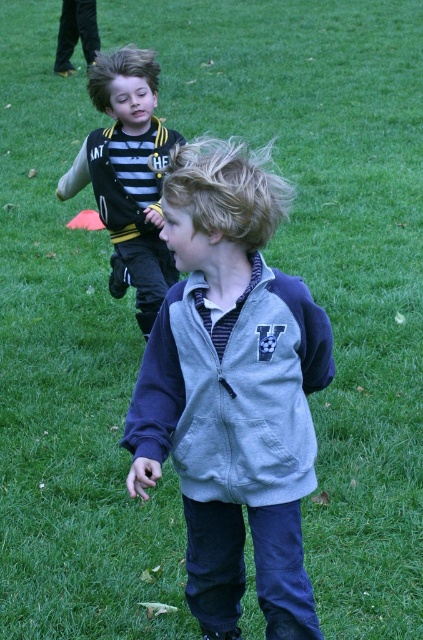
Question: Which point appears closest to the camera in this image?

Choices:
 (A) (154, 125)
 (B) (271, 445)

Answer: (B)

Question: Can you confirm if gray fleece jacket at center is thinner than striped jersey at left?

Choices:
 (A) no
 (B) yes

Answer: (A)

Question: Which point appears closest to the camera in this image?

Choices:
 (A) (154, 205)
 (B) (247, 188)

Answer: (B)

Question: Which point is farther from the camera taking this photo?

Choices:
 (A) (291, 420)
 (B) (101, 147)

Answer: (B)

Question: Is gray fleece jacket at center further to camera compared to striped jersey at left?

Choices:
 (A) no
 (B) yes

Answer: (A)

Question: Can you confirm if gray fleece jacket at center is thinner than striped jersey at left?

Choices:
 (A) yes
 (B) no

Answer: (B)